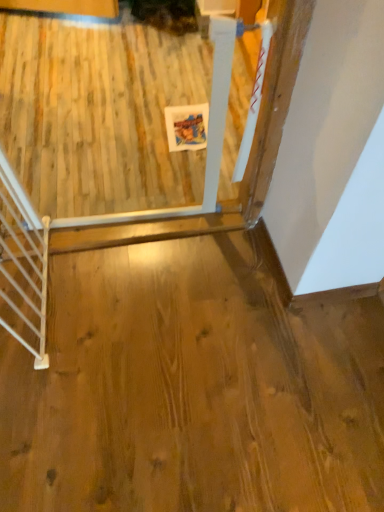
Describe the element at coordinates (23, 262) in the screenshot. I see `white plastic gate at left` at that location.

I want to click on white plastic gate at left, so click(x=23, y=262).

At what (x,y) coordinates should I click in order to perform the action: click on white plastic gate at left. Please return your answer as a coordinate pair (x, y). Looking at the image, I should click on (23, 262).